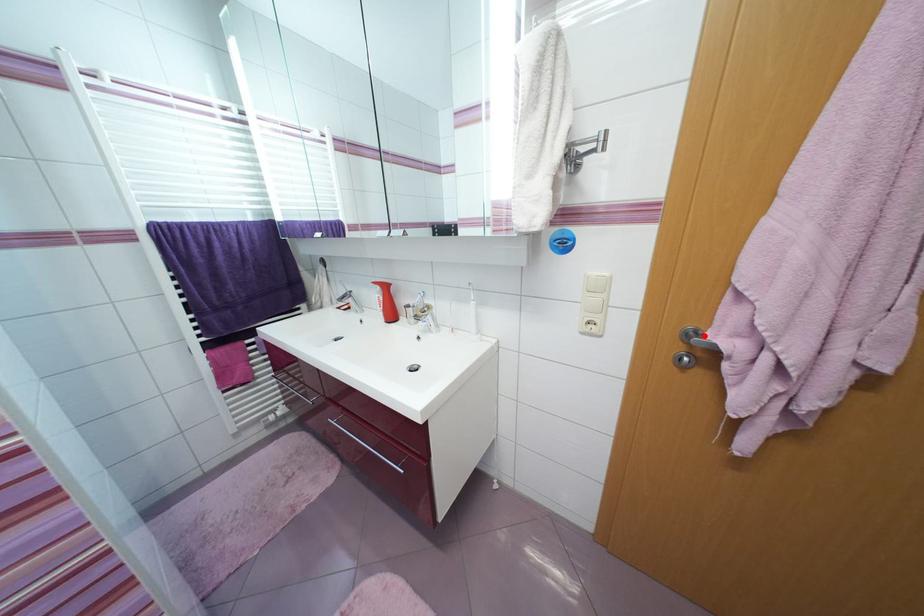
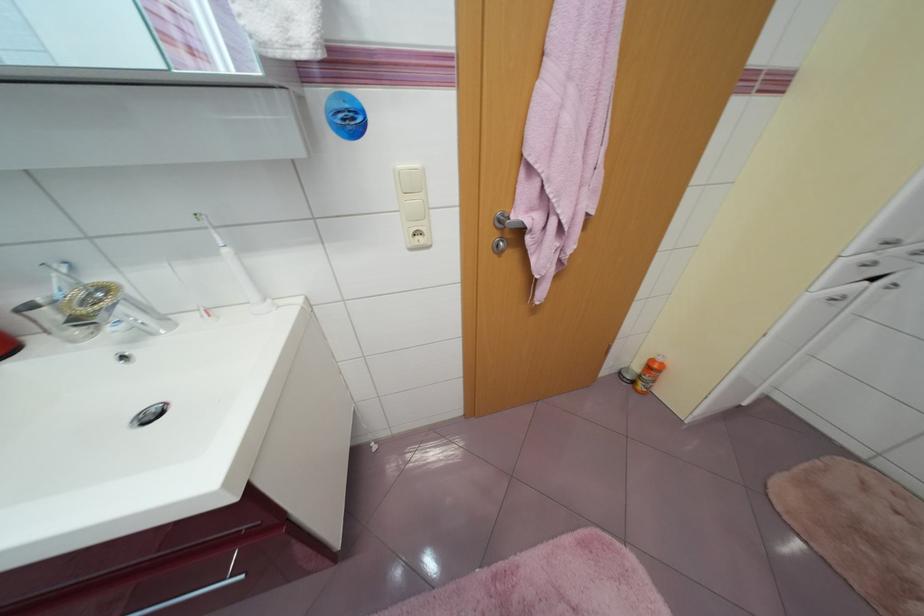
In the second image, find the point that corresponds to the highlighted location in the first image.

(513, 219)